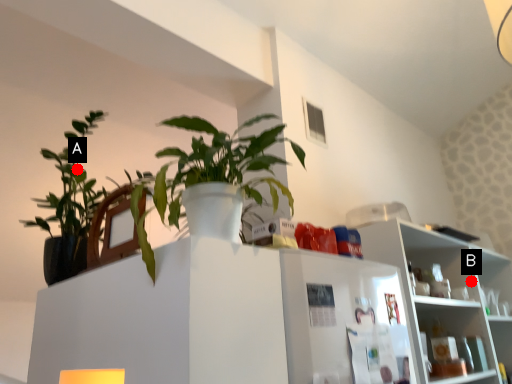
Question: Two points are circled on the image, labeled by A and B beside each circle. Which of the following is the farthest from the observer?

Choices:
 (A) A is further
 (B) B is further

Answer: (B)